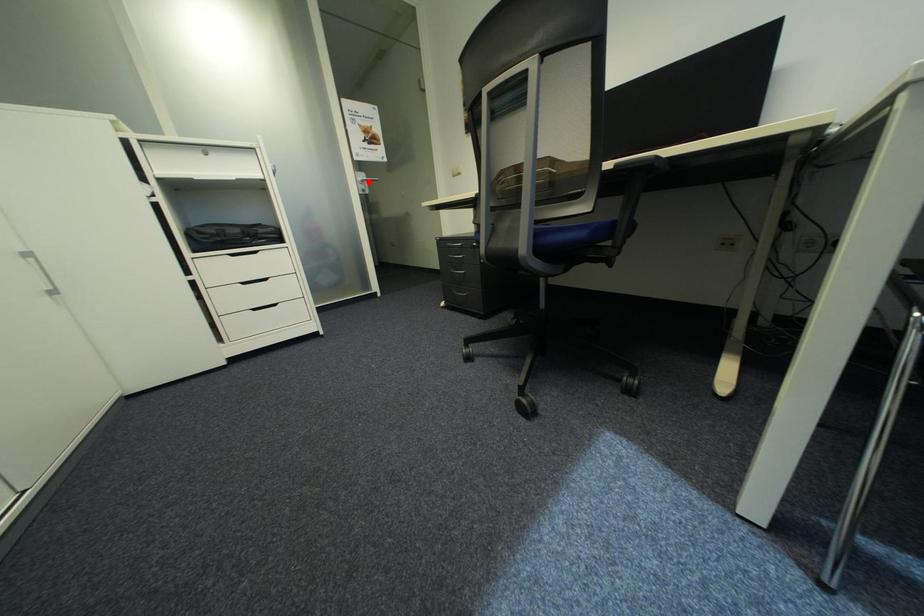
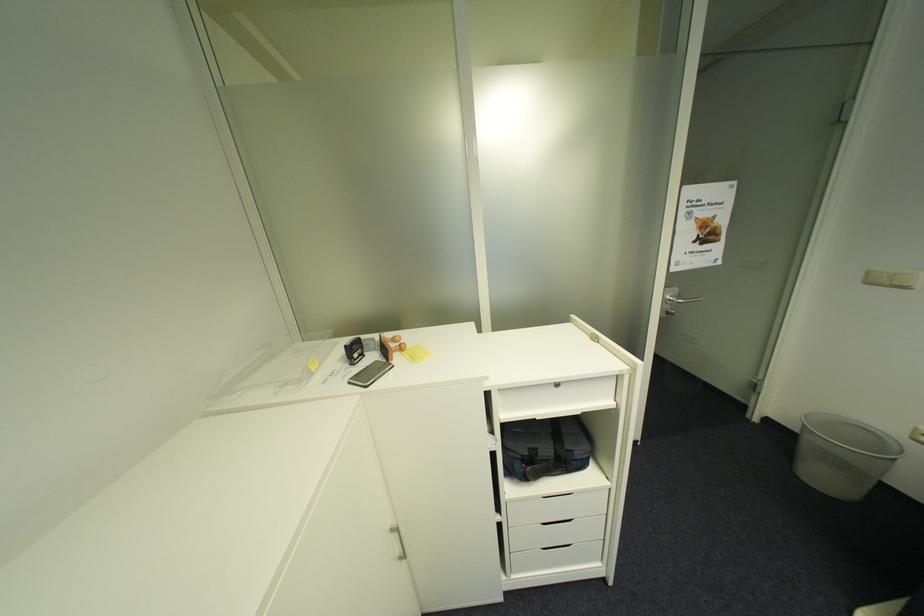
Question: I am providing you with two images of the same scene from different viewpoints. Given a red point in image1, look at the same physical point in image2. Is it:

Choices:
 (A) Closer to the viewpoint
 (B) Farther from the viewpoint

Answer: (B)